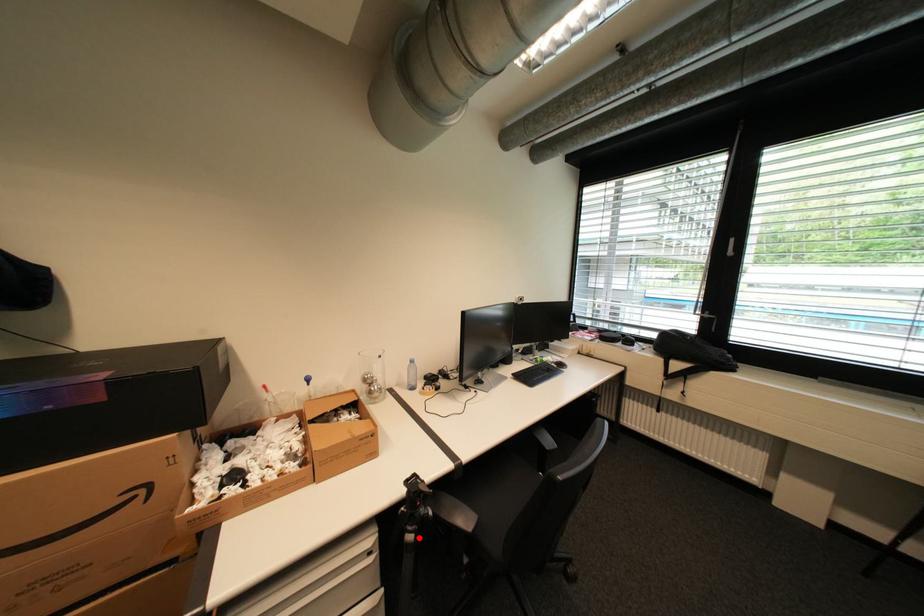
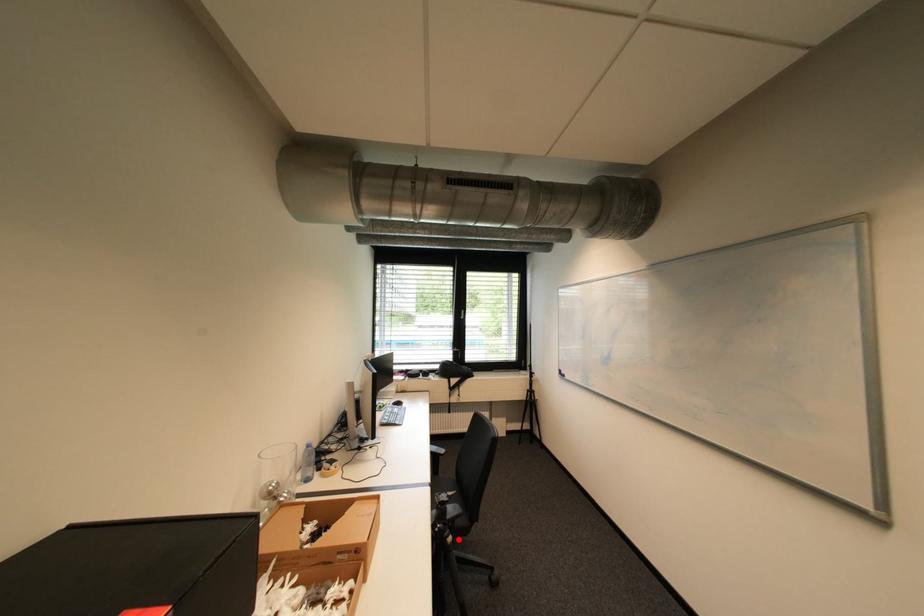
I am providing you with two images of the same scene from different viewpoints. A red point is marked on the first image and another point is marked on the second image. Are the points marked in image1 and image2 representing the same 3D position?

Yes